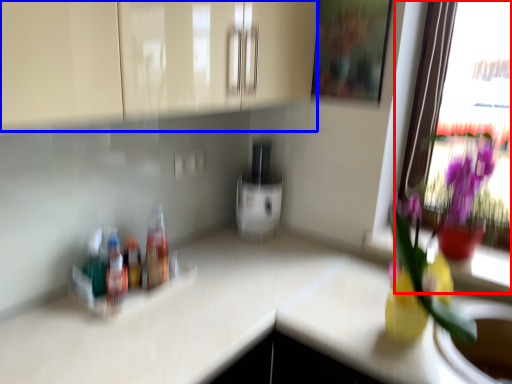
Question: Which point is further to the camera, window (highlighted by a red box) or cabinetry (highlighted by a blue box)?

Choices:
 (A) window
 (B) cabinetry

Answer: (A)